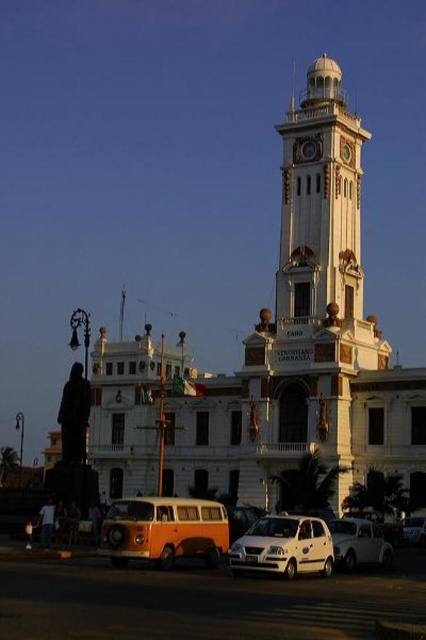
You are standing at the base of the white painted stone clock tower at upper center and want to take a photo of it with your camera. The camera is 71.24 meters away from the tower. Is this distance sufficient to capture the entire tower in one frame?

The white painted stone clock tower at upper center and camera are 71.24 meters apart from each other. This distance should be sufficient to capture the entire tower in one frame, as most cameras can easily capture such a large structure from that distance.

You are standing in front of the grand historic building with a clock tower. There is a point marked at coordinates (310, 300). Which object does this point belong to?

The point at (310, 300) is on the white painted stone clock tower at upper center.